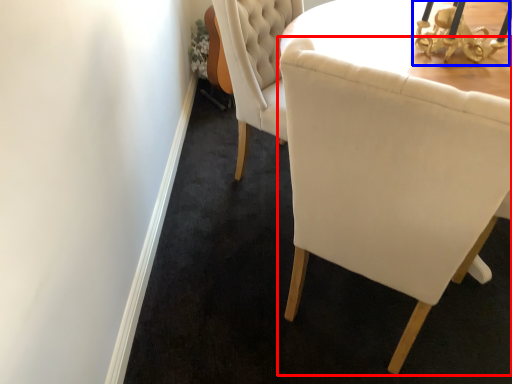
Question: Which point is closer to the camera, chair (highlighted by a red box) or table lamp (highlighted by a blue box)?

Choices:
 (A) chair
 (B) table lamp

Answer: (A)